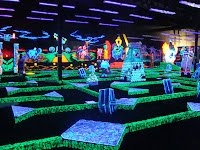
This screenshot has width=200, height=150. What are the coordinates of `lighting on the ceiling` in the screenshot? It's located at (108, 24), (90, 17), (54, 14), (147, 18).